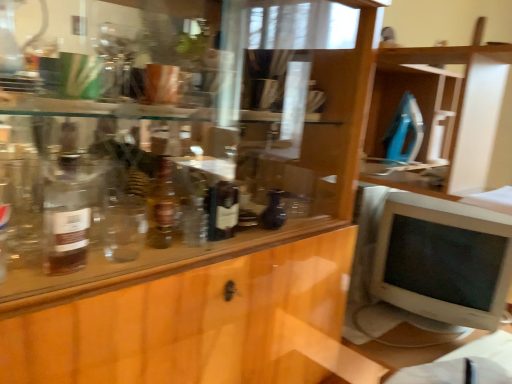
What do you see at coordinates (65, 219) in the screenshot? I see `translucent glass bottle at left, which is counted as the first bottle, starting from the front` at bounding box center [65, 219].

I want to click on white plastic monitor at right, so click(443, 260).

Image resolution: width=512 pixels, height=384 pixels. Describe the element at coordinates (443, 260) in the screenshot. I see `white plastic monitor at right` at that location.

You are a GUI agent. You are given a task and a screenshot of the screen. Output one action in this format:
    pyautogui.click(x=<x>, y=<y>)
    Task: Click on the translucent glass bottle at left, which is counted as the first bottle, starting from the front
    This screenshot has height=384, width=512.
    Given the screenshot: What is the action you would take?
    pyautogui.click(x=65, y=219)

From the image's perspective, between white plastic monitor at right and white glossy table at lower right, which one is located above?

white plastic monitor at right, from the image's perspective.

Is white plastic monitor at right positioned far away from white glossy table at lower right?

They are positioned close to each other.

Which is closer, (479, 281) or (410, 333)?

The point (479, 281) is closer to the camera.

Is white plastic monitor at right closer to camera compared to white glossy table at lower right?

No, it is behind white glossy table at lower right.

Can you see white glossy table at lower right touching translucent glass bottle at left, acting as the 2th bottle starting from the right?

They are not placed beside each other.

In the scene shown: From a real-world perspective, is white glossy table at lower right positioned above or below translucent glass bottle at left, which is counted as the second bottle, starting from the back?

white glossy table at lower right is below translucent glass bottle at left, which is counted as the second bottle, starting from the back.

In terms of size, does white glossy table at lower right appear bigger or smaller than translucent glass bottle at left, the 1th bottle when ordered from left to right?

Clearly, white glossy table at lower right is larger in size than translucent glass bottle at left, the 1th bottle when ordered from left to right.

Identify the location of table that is on the right side of translucent glass bottle at left, acting as the 2th bottle starting from the right. (395, 346).

From the image's perspective, is white glossy table at lower right above white plastic monitor at right?

Incorrect, from the image's perspective, white glossy table at lower right is lower than white plastic monitor at right.

Measure the distance between white glossy table at lower right and white plastic monitor at right.

6.97 inches.

Consider the image. Considering the sizes of objects white glossy table at lower right and white plastic monitor at right in the image provided, who is shorter, white glossy table at lower right or white plastic monitor at right?

white glossy table at lower right.

Is white glossy table at lower right oriented towards white plastic monitor at right?

No, white glossy table at lower right does not turn towards white plastic monitor at right.

How distant is white glossy table at lower right from matte black vase at center, arranged as the second bottle when viewed from the left?

white glossy table at lower right and matte black vase at center, arranged as the second bottle when viewed from the left, are 21.55 inches apart from each other.

Based on the photo, from the image's perspective, who appears lower, white glossy table at lower right or matte black vase at center, arranged as the second bottle when viewed from the left?

white glossy table at lower right is shown below in the image.

Is white glossy table at lower right positioned with its back to matte black vase at center, which ranks as the 1th bottle in back-to-front order?

No, white glossy table at lower right is not facing away from matte black vase at center, which ranks as the 1th bottle in back-to-front order.

What's the angular difference between white glossy table at lower right and matte black vase at center, the second bottle positioned from the front,'s facing directions?

2.44 degrees.

Which of these two, matte black vase at center, which ranks as the 1th bottle in back-to-front order, or white plastic monitor at right, is smaller?

With smaller size is matte black vase at center, which ranks as the 1th bottle in back-to-front order.

Between point (263, 227) and point (496, 252), which one is positioned in front?

The point (263, 227) is more forward.

At what (x,y) coordinates should I click in order to perform the action: click on the 1st bottle above the white plastic monitor at right (from the image's perspective). Please return your answer as a coordinate pair (x, y). This screenshot has width=512, height=384. Looking at the image, I should click on (273, 211).

Is point (280, 194) less distant than point (67, 179)?

No, (280, 194) is behind (67, 179).

Do you think matte black vase at center, the second bottle positioned from the front, is within translucent glass bottle at left, acting as the 2th bottle starting from the right, or outside of it?

matte black vase at center, the second bottle positioned from the front, cannot be found inside translucent glass bottle at left, acting as the 2th bottle starting from the right.

Can you confirm if matte black vase at center, the second bottle positioned from the front, is wider than translucent glass bottle at left, acting as the 2th bottle starting from the right?

No, matte black vase at center, the second bottle positioned from the front, is not wider than translucent glass bottle at left, acting as the 2th bottle starting from the right.

Measure the distance between matte black vase at center, which ranks as the 1th bottle in back-to-front order, and translucent glass bottle at left, which is counted as the second bottle, starting from the back.

The distance of matte black vase at center, which ranks as the 1th bottle in back-to-front order, from translucent glass bottle at left, which is counted as the second bottle, starting from the back, is 43.80 centimeters.

Considering the sizes of objects translucent glass bottle at left, acting as the 2th bottle starting from the right, and matte black vase at center, acting as the 1th bottle starting from the right, in the image provided, who is bigger, translucent glass bottle at left, acting as the 2th bottle starting from the right, or matte black vase at center, acting as the 1th bottle starting from the right,?

translucent glass bottle at left, acting as the 2th bottle starting from the right.

Considering the positions of objects translucent glass bottle at left, acting as the 2th bottle starting from the right, and matte black vase at center, arranged as the second bottle when viewed from the left, in the image provided, who is in front, translucent glass bottle at left, acting as the 2th bottle starting from the right, or matte black vase at center, arranged as the second bottle when viewed from the left,?

Positioned in front is translucent glass bottle at left, acting as the 2th bottle starting from the right.

At what (x,y) coordinates should I click in order to perform the action: click on computer monitor positioned vertically above the white glossy table at lower right (from a real-world perspective). Please return your answer as a coordinate pair (x, y). Looking at the image, I should click on (443, 260).

I want to click on table below the translucent glass bottle at left, the 1th bottle when ordered from left to right (from the image's perspective), so click(395, 346).

From the image, which object appears to be nearer to white plastic monitor at right, matte black vase at center, acting as the 1th bottle starting from the right, or white glossy table at lower right?

white glossy table at lower right lies closer to white plastic monitor at right than the other object.

Considering their positions, is white plastic monitor at right positioned closer to matte black vase at center, the second bottle positioned from the front, than translucent glass bottle at left, acting as the 2th bottle starting from the right?

translucent glass bottle at left, acting as the 2th bottle starting from the right.

Based on their spatial positions, is white glossy table at lower right or translucent glass bottle at left, acting as the 2th bottle starting from the right, closer to white plastic monitor at right?

The object closer to white plastic monitor at right is white glossy table at lower right.

Which object lies further to the anchor point white plastic monitor at right, translucent glass bottle at left, acting as the 2th bottle starting from the right, or white glossy table at lower right?

The object further to white plastic monitor at right is translucent glass bottle at left, acting as the 2th bottle starting from the right.

From the image, which object appears to be farther from translucent glass bottle at left, which is counted as the first bottle, starting from the front, white glossy table at lower right or white plastic monitor at right?

white plastic monitor at right lies further to translucent glass bottle at left, which is counted as the first bottle, starting from the front, than the other object.

Based on their spatial positions, is white glossy table at lower right or matte black vase at center, which ranks as the 1th bottle in back-to-front order, further from white plastic monitor at right?

Based on the image, matte black vase at center, which ranks as the 1th bottle in back-to-front order, appears to be further to white plastic monitor at right.

Considering their positions, is white plastic monitor at right positioned further to translucent glass bottle at left, acting as the 2th bottle starting from the right, than white glossy table at lower right?

Among the two, white plastic monitor at right is located further to translucent glass bottle at left, acting as the 2th bottle starting from the right.

Looking at the image, which one is located closer to matte black vase at center, the second bottle positioned from the front, white glossy table at lower right or white plastic monitor at right?

white glossy table at lower right.

The image size is (512, 384). I want to click on table between translucent glass bottle at left, which is counted as the second bottle, starting from the back, and white plastic monitor at right from left to right, so click(x=395, y=346).

Find the location of a particular element. table between matte black vase at center, which ranks as the 1th bottle in back-to-front order, and white plastic monitor at right from left to right is located at coordinates (395, 346).

In order to click on bottle between translucent glass bottle at left, which is counted as the first bottle, starting from the front, and white plastic monitor at right in this screenshot , I will do `click(273, 211)`.

This screenshot has height=384, width=512. I want to click on bottle situated between translucent glass bottle at left, which is counted as the first bottle, starting from the front, and white glossy table at lower right from left to right, so coord(273,211).